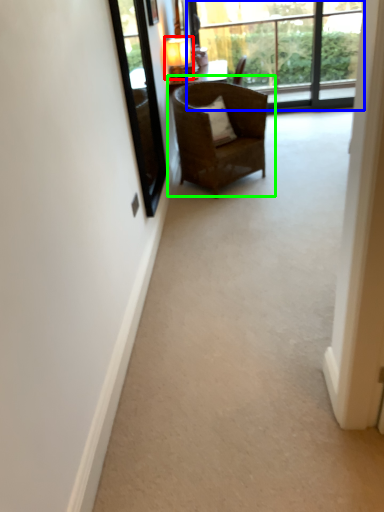
Question: Estimate the real-world distances between objects in this image. Which object is farther from lamp (highlighted by a red box), window (highlighted by a blue box) or chair (highlighted by a green box)?

Choices:
 (A) window
 (B) chair

Answer: (A)